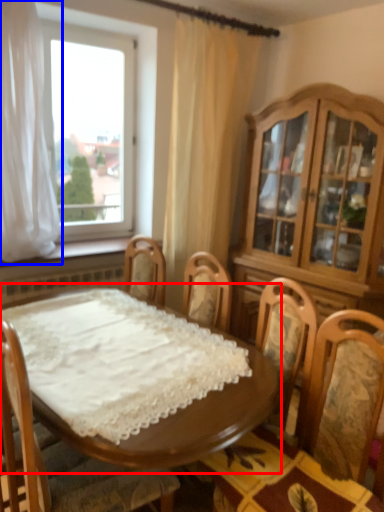
Question: Among these objects, which one is nearest to the camera, table (highlighted by a red box) or curtain (highlighted by a blue box)?

Choices:
 (A) table
 (B) curtain

Answer: (A)